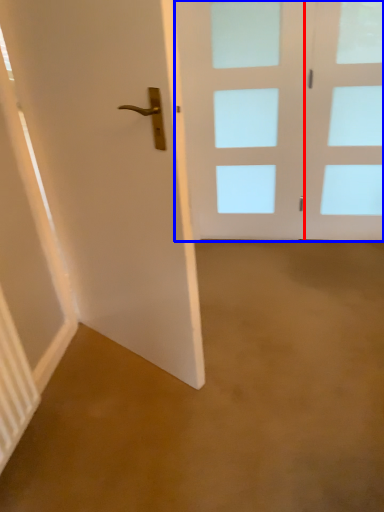
Question: Among these objects, which one is nearest to the camera, glass door (highlighted by a red box) or door (highlighted by a blue box)?

Choices:
 (A) glass door
 (B) door

Answer: (A)